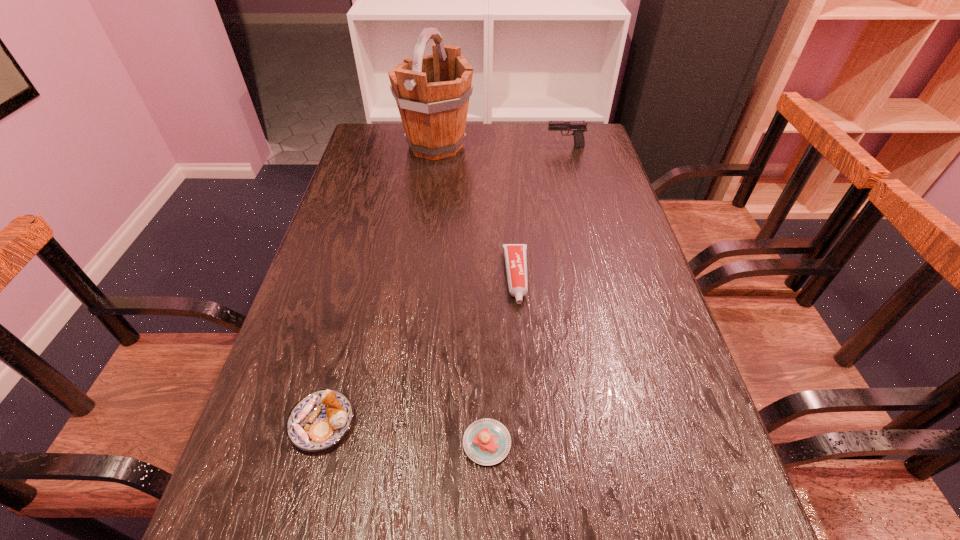
The height and width of the screenshot is (540, 960). I want to click on the tallest object, so click(432, 92).

Locate an element on the screen. The height and width of the screenshot is (540, 960). the fourth shortest object is located at coordinates (578, 127).

Locate an element on the screen. The height and width of the screenshot is (540, 960). the rightmost object is located at coordinates (578, 127).

Locate an element on the screen. The image size is (960, 540). the taller pastry is located at coordinates (318, 421).

Where is `the third farthest object`? This screenshot has height=540, width=960. the third farthest object is located at coordinates (515, 254).

You are a GUI agent. You are given a task and a screenshot of the screen. Output one action in this format:
    pyautogui.click(x=<x>, y=<y>)
    Task: Click on the toothpaste
    This screenshot has width=960, height=540.
    Given the screenshot: What is the action you would take?
    pyautogui.click(x=515, y=254)

Image resolution: width=960 pixels, height=540 pixels. Identify the location of the shorter pastry. (487, 442).

Where is `the right pastry`? The image size is (960, 540). the right pastry is located at coordinates (487, 442).

Where is `vacant space located on the front of the bucket`? The image size is (960, 540). vacant space located on the front of the bucket is located at coordinates (429, 199).

The height and width of the screenshot is (540, 960). Identify the location of vacant region located 0.220m aim along the barrel of the pistol. (480, 147).